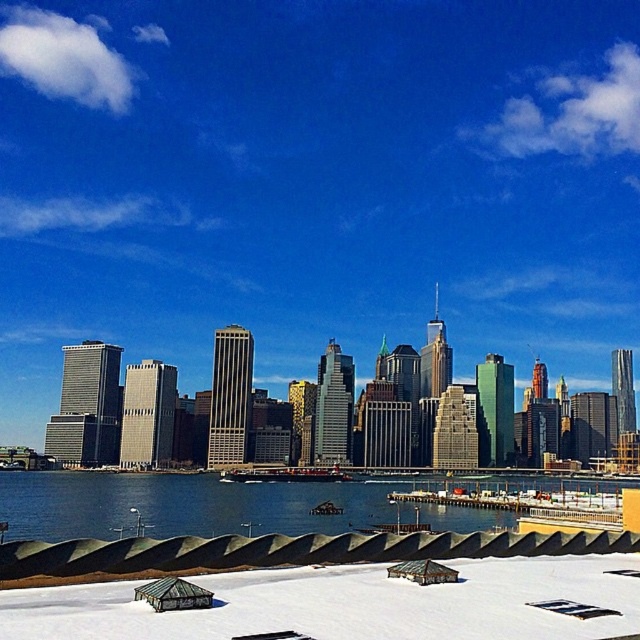
You are a delivery drone that needs to fly from the white matte snow at lower center to the blue water at lower center. What is the shortest distance you must travel?

The shortest distance between the white matte snow at lower center and the blue water at lower center is 82.63 meters.

You are an architect designing a new city park and want to incorporate elements from this cityscape. If you want to include both the white matte snow at lower center and the blue water at lower center, which one should you make larger in your design to stay true to the original image?

The blue water at lower center is larger than the white matte snow at lower center in the original image, so you should make the blue water at lower center larger in your design.

You are standing at the edge of the city and see the white matte snow at lower center and the blue water at lower center. Which object is covering the other one?

The white matte snow at lower center is positioned over blue water at lower center, so it is covering the blue water at lower center.